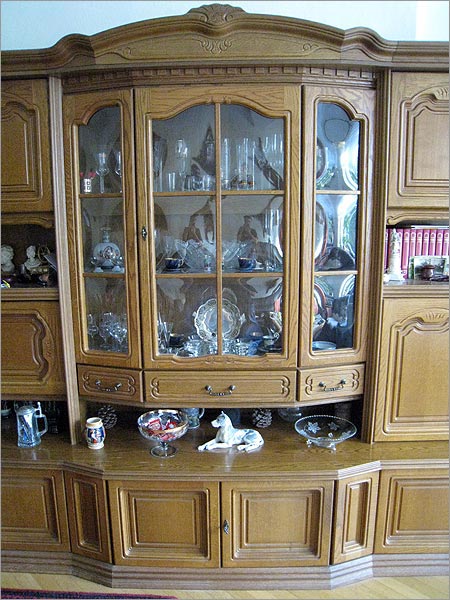
Find the location of `candy dish`. candy dish is located at coordinates (330, 433).